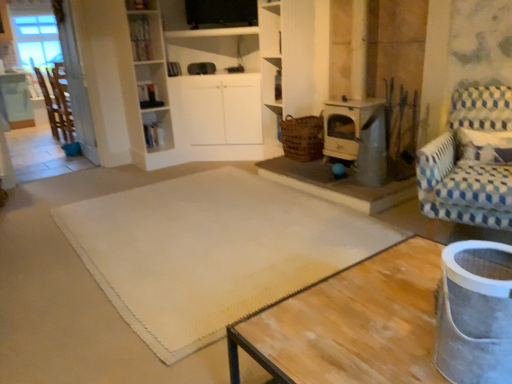
The height and width of the screenshot is (384, 512). In order to click on vacant space situated above white textured mat at center (from a real-world perspective) in this screenshot , I will do `click(199, 233)`.